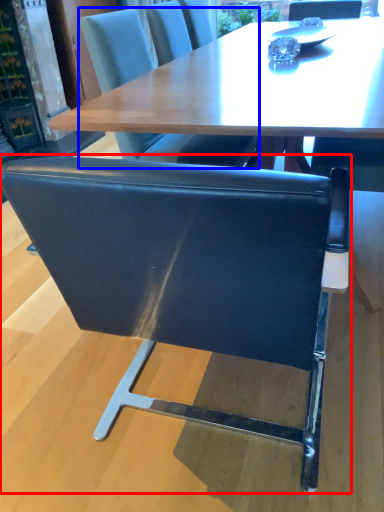
Question: Which of the following is the farthest to the observer, chair (highlighted by a red box) or chair (highlighted by a blue box)?

Choices:
 (A) chair
 (B) chair

Answer: (B)